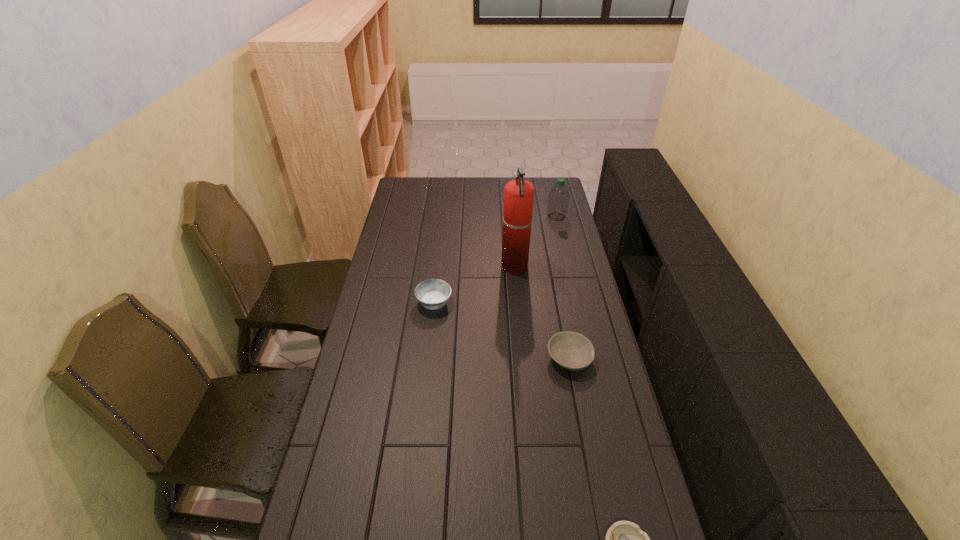
Identify the location of vacant space situated 0.220m with the nozzle and gauge on the fire extinguisher. The height and width of the screenshot is (540, 960). pos(448,267).

Locate an element on the screen. The image size is (960, 540). free space located 0.180m on the front of the water bottle is located at coordinates (564, 245).

Where is `blank area located 0.400m on the right of the leftmost object`? blank area located 0.400m on the right of the leftmost object is located at coordinates (558, 303).

You are a GUI agent. You are given a task and a screenshot of the screen. Output one action in this format:
    pyautogui.click(x=<x>, y=<y>)
    Task: Click on the free space located on the left of the fourth farthest object
    The height and width of the screenshot is (540, 960).
    Given the screenshot: What is the action you would take?
    pyautogui.click(x=435, y=358)

Where is `water bottle situated at the right edge`? This screenshot has height=540, width=960. water bottle situated at the right edge is located at coordinates (558, 198).

The width and height of the screenshot is (960, 540). Identify the location of bowl located in the right edge section of the desktop. (571, 350).

Find the location of a particular element. This screenshot has height=540, width=960. vacant space at the far edge of the desktop is located at coordinates click(466, 179).

The height and width of the screenshot is (540, 960). What are the coordinates of `free space at the left edge of the desktop` in the screenshot? It's located at (387, 371).

This screenshot has height=540, width=960. Identify the location of vacant position at the right edge of the desktop. (553, 252).

In the image, there is a desktop. Identify the location of vacant area at the far right corner. The width and height of the screenshot is (960, 540). (540, 179).